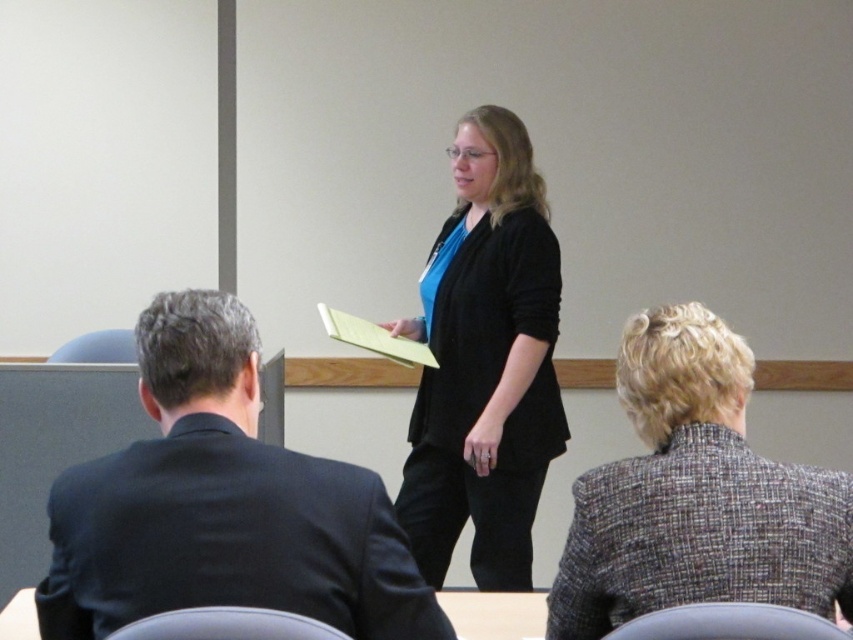
Question: Which object is closer to the camera taking this photo?

Choices:
 (A) dark blue suit at left
 (B) matte black blazer at center

Answer: (A)

Question: Estimate the real-world distances between objects in this image. Which object is farther from the dark blue suit at left?

Choices:
 (A) matte black blazer at center
 (B) gray tweed blazer at lower right

Answer: (A)

Question: Is dark blue suit at left to the left of matte black blazer at center from the viewer's perspective?

Choices:
 (A) yes
 (B) no

Answer: (A)

Question: Does gray tweed blazer at lower right have a greater width compared to matte black blazer at center?

Choices:
 (A) no
 (B) yes

Answer: (A)

Question: Can you confirm if gray tweed blazer at lower right is bigger than matte black blazer at center?

Choices:
 (A) yes
 (B) no

Answer: (B)

Question: Which point is closer to the camera?

Choices:
 (A) (642, 372)
 (B) (519, 333)
 (C) (186, 308)

Answer: (C)